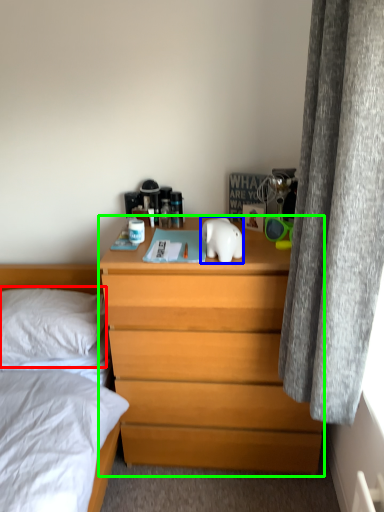
Question: Based on their relative distances, which object is nearer to pillow (highlighted by a red box)? Choose from animal (highlighted by a blue box) and chest of drawers (highlighted by a green box).

Choices:
 (A) animal
 (B) chest of drawers

Answer: (B)